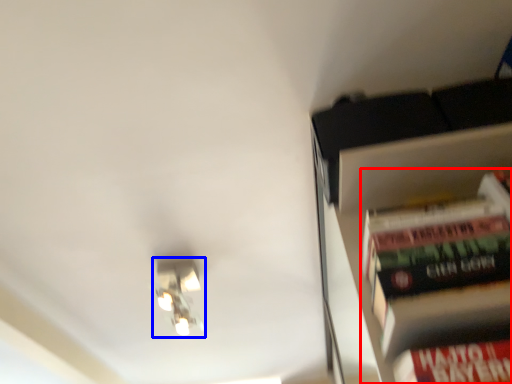
Question: Which point is further to the camera, book (highlighted by a red box) or light fixture (highlighted by a blue box)?

Choices:
 (A) book
 (B) light fixture

Answer: (B)